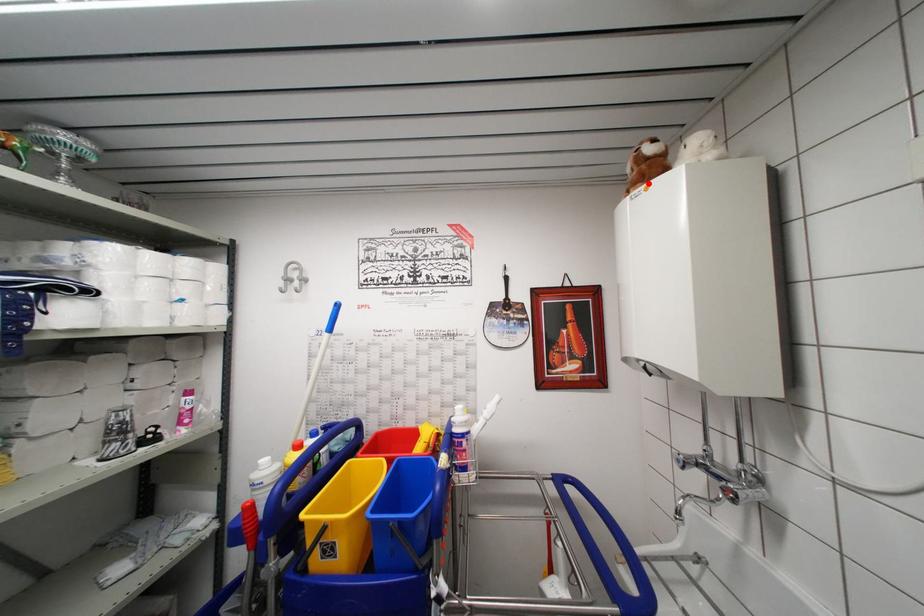
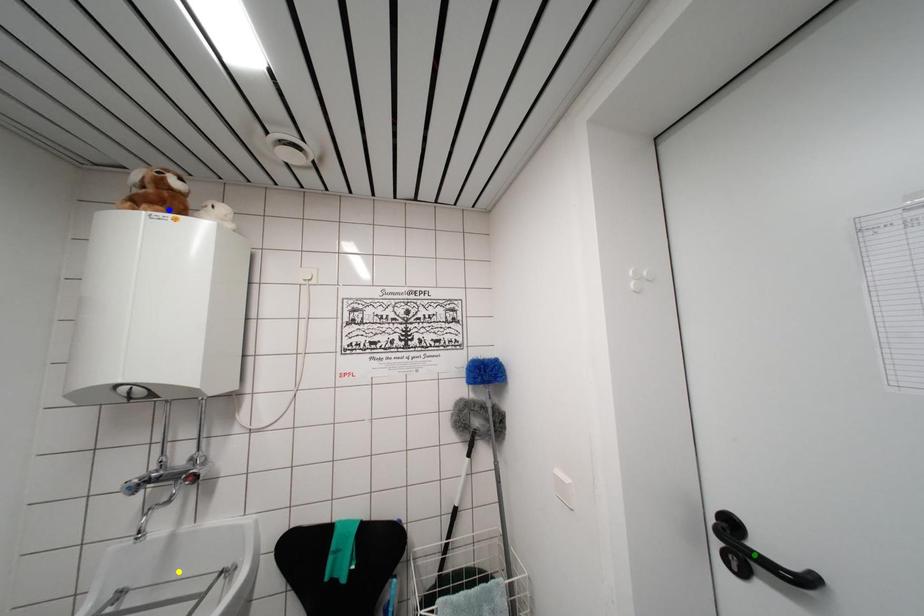
Question: I am providing you with two images of the same scene from different viewpoints. A red point is marked on the first image. You are given multiple points on the second image. Which point in image 2 represents the same 3d spot as the red point in image 1?

Choices:
 (A) blue point
 (B) green point
 (C) yellow point

Answer: (A)